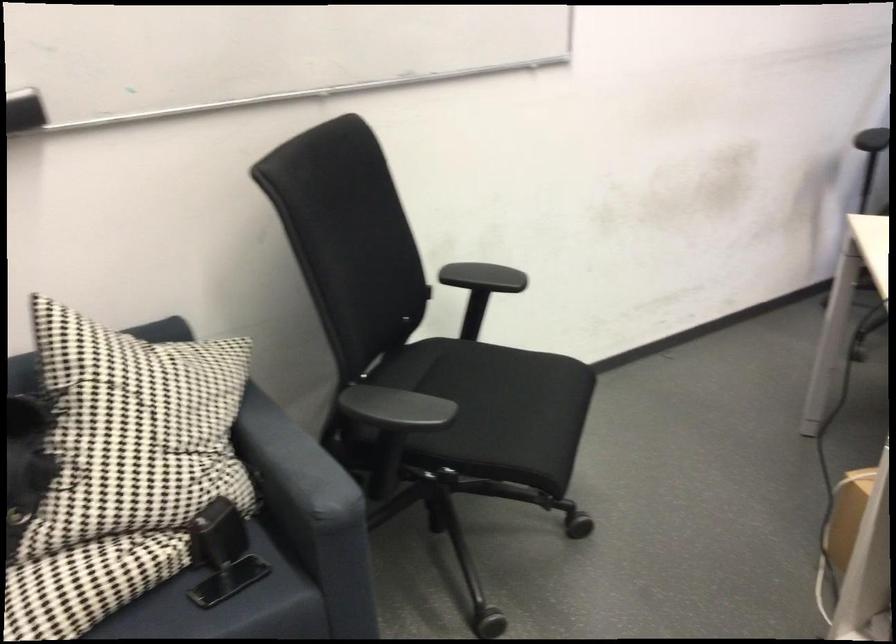
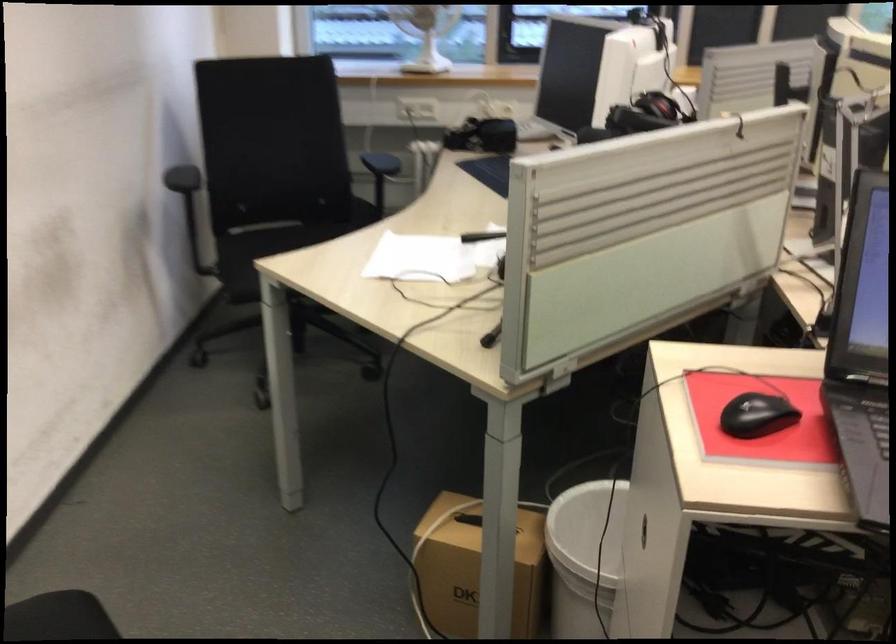
Question: How did the camera likely rotate?

Choices:
 (A) Left
 (B) Right
 (C) Up
 (D) Down

Answer: (B)